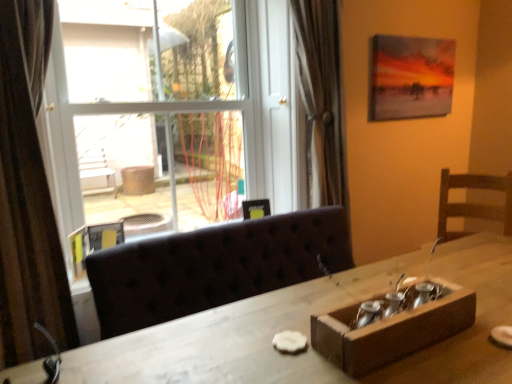
You are a GUI agent. You are given a task and a screenshot of the screen. Output one action in this format:
    pyautogui.click(x=<x>, y=<y>)
    Task: Click on the free space above wooden table at center (from a real-world perspective)
    The height and width of the screenshot is (384, 512).
    Given the screenshot: What is the action you would take?
    pyautogui.click(x=385, y=363)